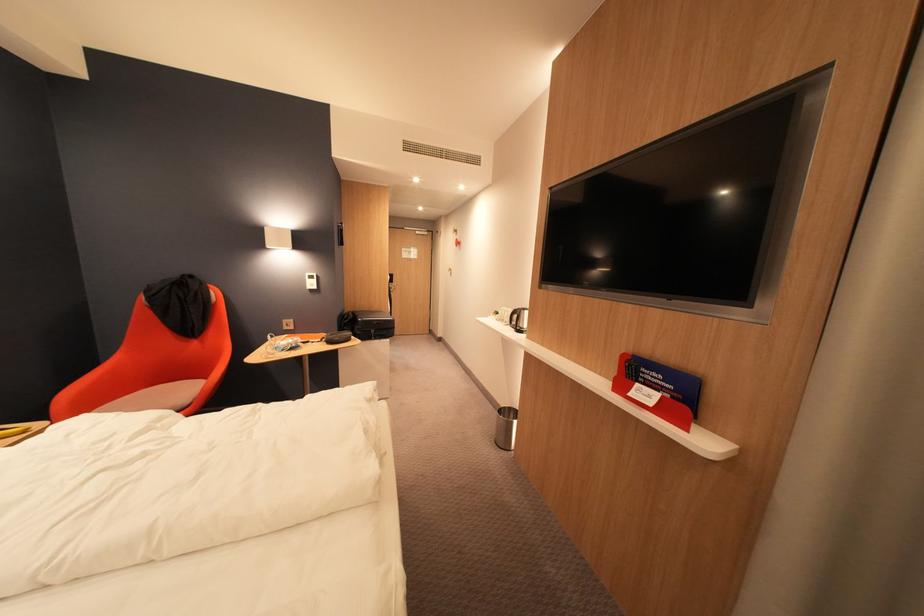
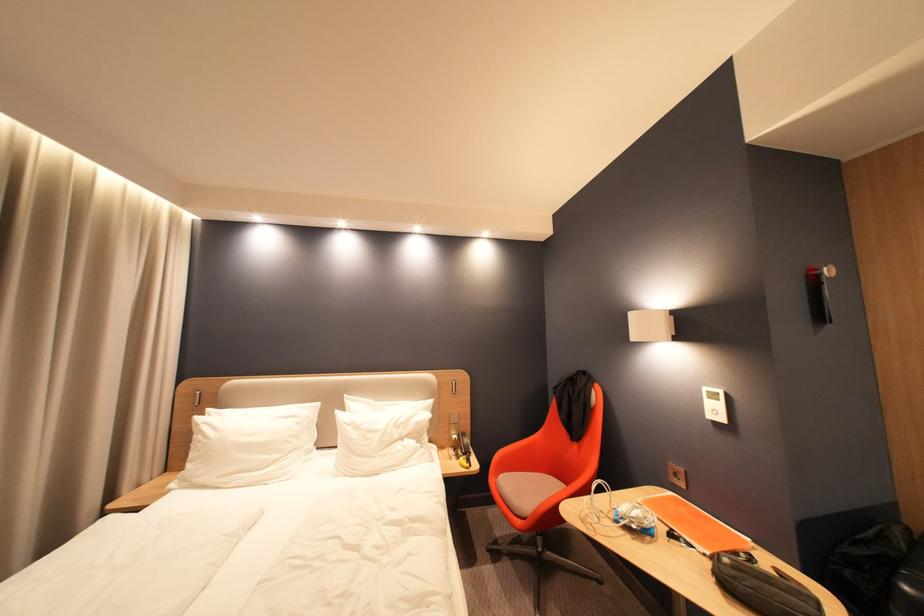
Find the pixel in the second image that matches (322,285) in the first image.

(724, 413)